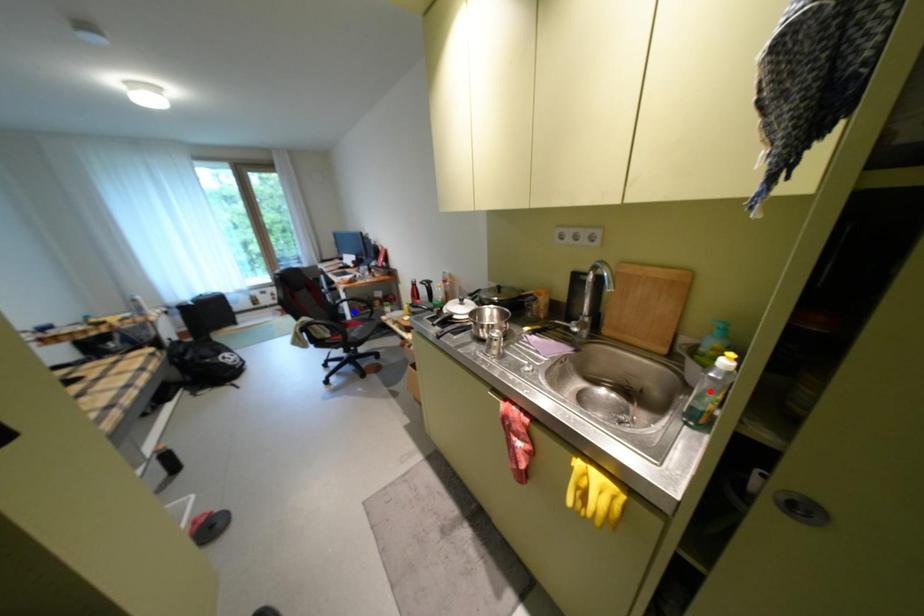
Question: Two points are marked on the image. Which point is closer to the camera?

Choices:
 (A) Blue point is closer.
 (B) Red point is closer.

Answer: (B)